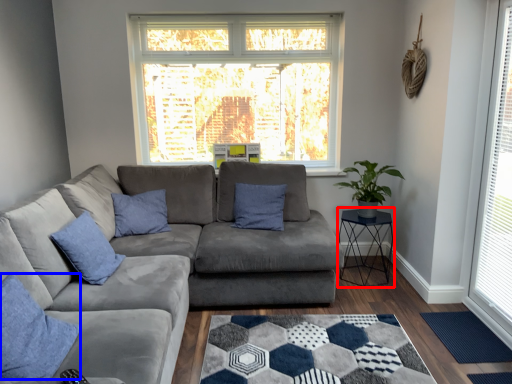
Question: Which point is closer to the camera, cocktail table (highlighted by a red box) or pillow (highlighted by a blue box)?

Choices:
 (A) cocktail table
 (B) pillow

Answer: (B)